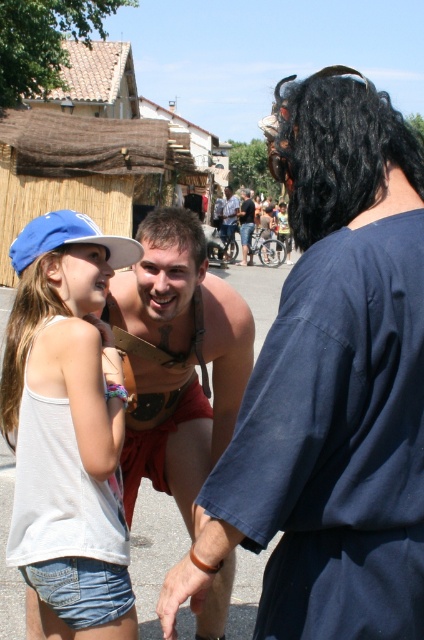
You are a photographer at the festival and want to capture a closeup of the shiny metallic belt at lower left without the white denim shorts at lower left being in the shot. Is it possible to do so given their positions?

The shiny metallic belt at lower left is positioned on the right side of white denim shorts at lower left, so they are adjacent. To avoid including the white denim shorts at lower left in the photo, the photographer would need to adjust the camera angle or crop the image to exclude the left area where the shorts are located.

From the picture: You are a photographer trying to capture a candid shot of the shiny metallic belt at lower left and the blue fabric baseball cap at upper left. Which object should you focus on first if you want to ensure both are in the frame without moving the camera?

You should focus on the shiny metallic belt at lower left first because it is positioned under the blue fabric baseball cap at upper left, meaning it is lower in the frame. By starting with the lower object, you can adjust the camera to include both without needing to reposition.

Where is the shiny metallic belt at lower left located in the image?

The shiny metallic belt at lower left is located at point (331, 387) in the image.